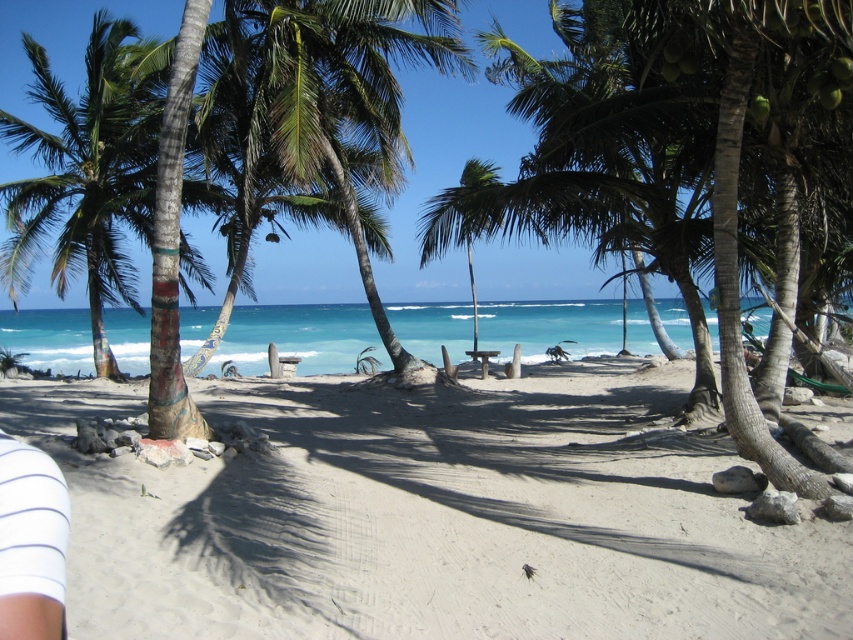
In the scene shown: Does white sandy beach at center come in front of white striped leg at lower left?

That is False.

Is point (575, 509) closer to camera compared to point (53, 500)?

No.

Where is `white sandy beach at center`? Image resolution: width=853 pixels, height=640 pixels. white sandy beach at center is located at coordinates (433, 516).

Can you confirm if white sandy beach at center is taller than green leafy palm tree at center?

Incorrect, white sandy beach at center's height is not larger of green leafy palm tree at center's.

In the scene shown: Does white sandy beach at center have a larger size compared to green leafy palm tree at center?

Actually, white sandy beach at center might be smaller than green leafy palm tree at center.

Find the location of `white sandy beach at center`. white sandy beach at center is located at coordinates (433, 516).

Is point (16, 524) positioned before point (447, 230)?

Yes.

Can you confirm if white striped leg at lower left is bigger than green leafy palm tree at center?

Actually, white striped leg at lower left might be smaller than green leafy palm tree at center.

What do you see at coordinates (32, 541) in the screenshot? I see `white striped leg at lower left` at bounding box center [32, 541].

Where is `white striped leg at lower left`? white striped leg at lower left is located at coordinates (32, 541).